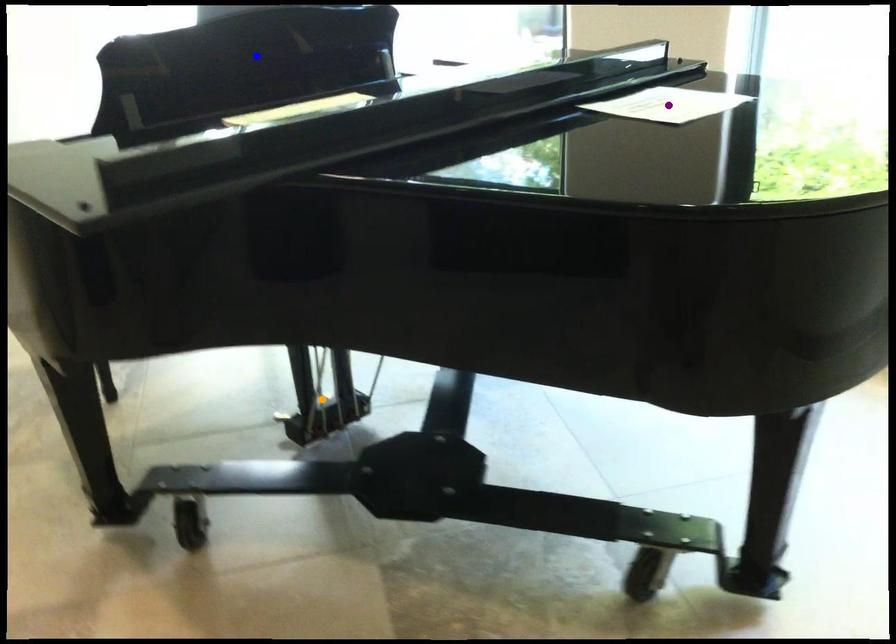
Order these from nearest to farthest:
blue point, purple point, orange point

purple point → blue point → orange point